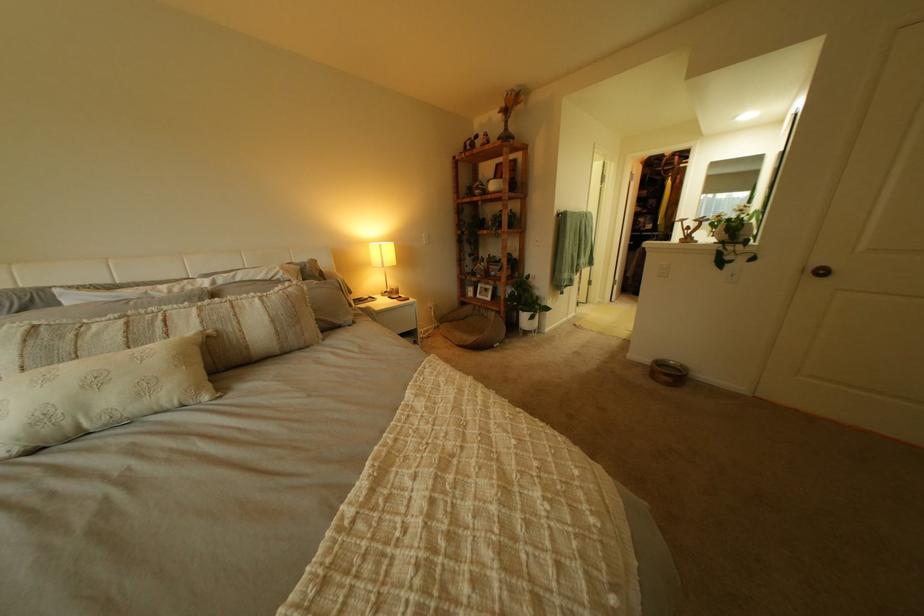
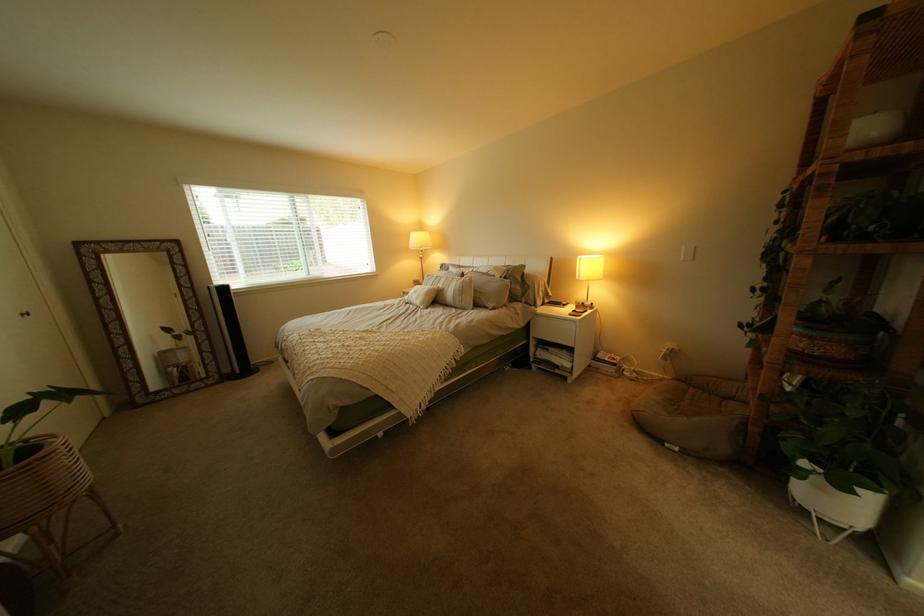
The point at (x=414, y=301) is marked in the first image. Where is the corresponding point in the second image?

(590, 314)